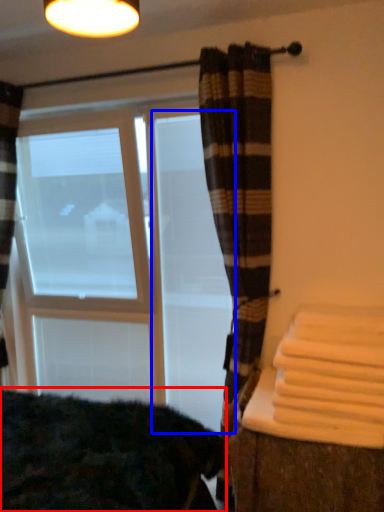
Question: Which object is further to the camera taking this photo, bedding (highlighted by a red box) or screen door (highlighted by a blue box)?

Choices:
 (A) bedding
 (B) screen door

Answer: (B)